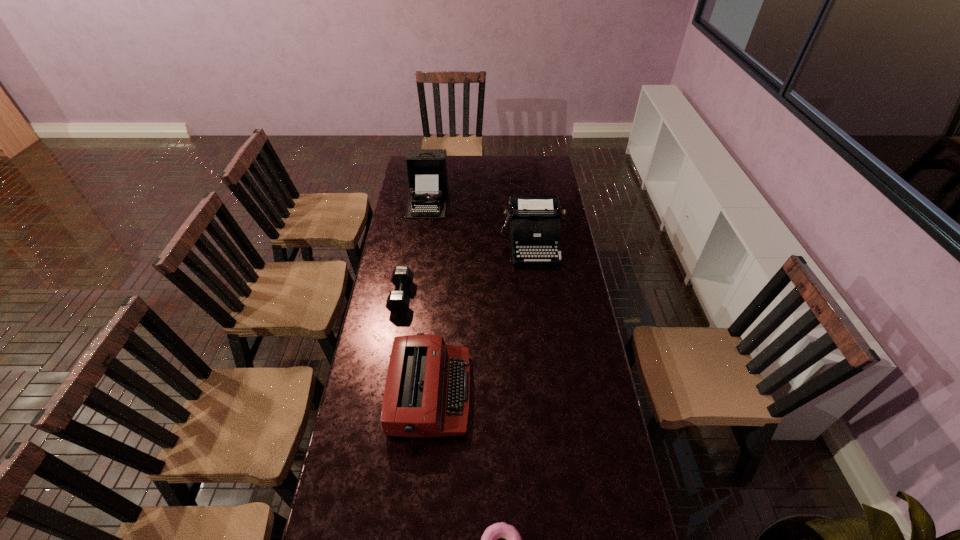
I want to click on vacant area situated on the typing side of the second nearest object, so click(x=502, y=393).

Where is `vacant space situated 0.060m on the back of the fourth tallest object`? The width and height of the screenshot is (960, 540). vacant space situated 0.060m on the back of the fourth tallest object is located at coordinates (406, 271).

Locate an element on the screen. dumbbell that is positioned at the left edge is located at coordinates (398, 302).

The height and width of the screenshot is (540, 960). I want to click on object positioned at the right edge, so click(535, 228).

Image resolution: width=960 pixels, height=540 pixels. What are the coordinates of `vacant region at the far edge of the desktop` in the screenshot? It's located at (450, 163).

In the image, there is a desktop. At what (x,y) coordinates should I click in order to perform the action: click on vacant region at the left edge. Please return your answer as a coordinate pair (x, y). This screenshot has width=960, height=540. Looking at the image, I should click on (x=374, y=326).

The image size is (960, 540). What are the coordinates of `free space at the right edge` in the screenshot? It's located at (592, 491).

I want to click on vacant area at the far left corner, so click(x=404, y=173).

Identify the location of free space between the farthest object and the second farthest object. (480, 221).

At what (x,y) coordinates should I click in order to perform the action: click on free space that is in between the second nearest object and the second nearest typewriter. Please return your answer as a coordinate pair (x, y). This screenshot has width=960, height=540. Looking at the image, I should click on pyautogui.click(x=481, y=318).